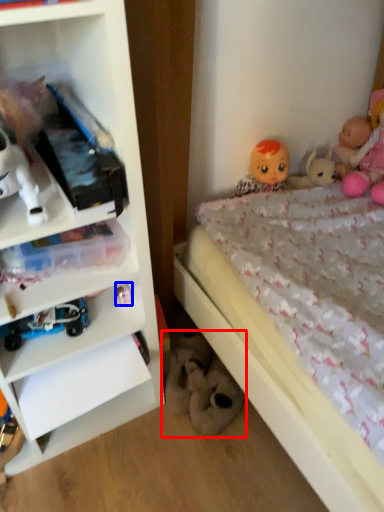
Question: Which of the following is the closest to the observer, toy (highlighted by a red box) or toy (highlighted by a blue box)?

Choices:
 (A) toy
 (B) toy

Answer: (B)